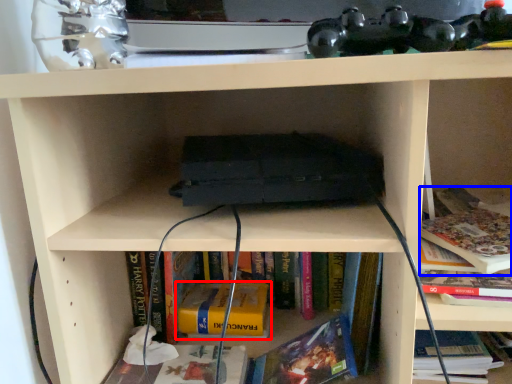
Question: Which object appears closest to the camera in this image, book (highlighted by a red box) or book (highlighted by a blue box)?

Choices:
 (A) book
 (B) book

Answer: (B)